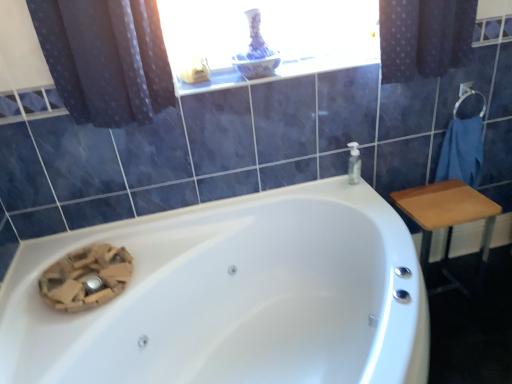
Question: In terms of width, does white glossy bathtub at center look wider or thinner when compared to white glossy window sill at upper center?

Choices:
 (A) wide
 (B) thin

Answer: (A)

Question: Is point (397, 322) closer or farther from the camera than point (181, 87)?

Choices:
 (A) farther
 (B) closer

Answer: (B)

Question: Based on their relative distances, which object is nearer to the white glossy window sill at upper center?

Choices:
 (A) wooden table at right
 (B) blue cotton towel at right
 (C) white glossy bathtub at center
 (D) transparent plastic soap dispenser at upper right

Answer: (D)

Question: Which is farther from the white glossy bathtub at center?

Choices:
 (A) transparent plastic soap dispenser at upper right
 (B) blue cotton towel at right
 (C) white glossy window sill at upper center
 (D) wooden table at right

Answer: (B)